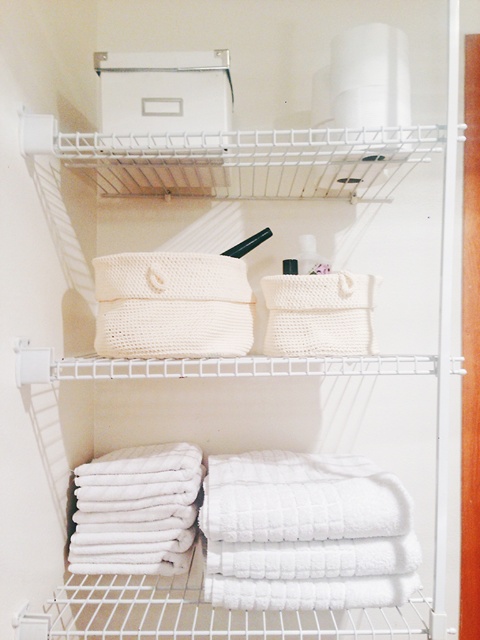
Who is lower down, white plastic toiletries at center or matte black toiletry at center?

matte black toiletry at center

Can you confirm if white plastic toiletries at center is shorter than matte black toiletry at center?

No.

Who is more forward, (321, 262) or (283, 269)?

Point (321, 262) is in front.

I want to click on white plastic toiletries at center, so click(310, 257).